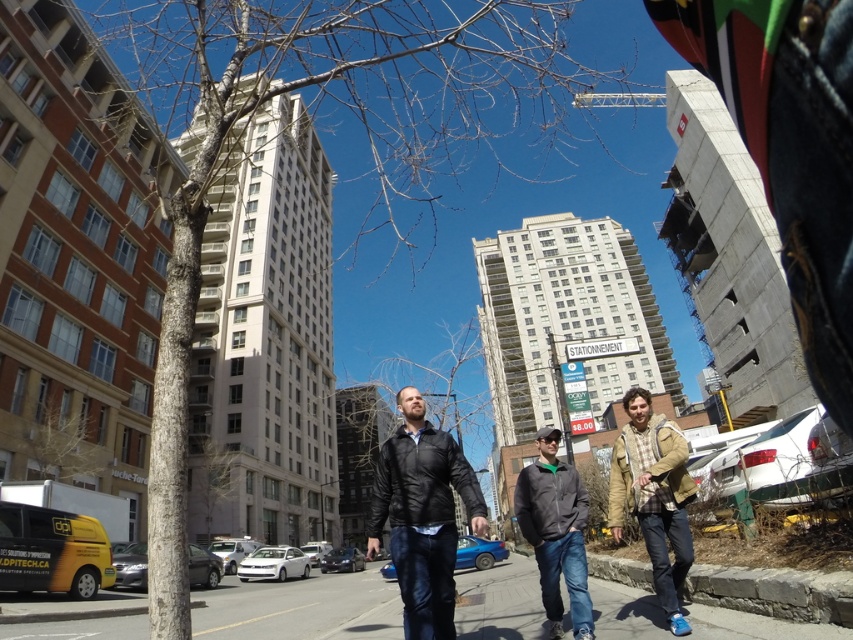
You are a fashion designer observing the urban street scene. You notice the black leather jacket at center and the khaki plaid shirt at center. Which clothing item appears larger in size?

The black leather jacket at center is bigger than the khaki plaid shirt at center, so the black leather jacket at center appears larger in size.